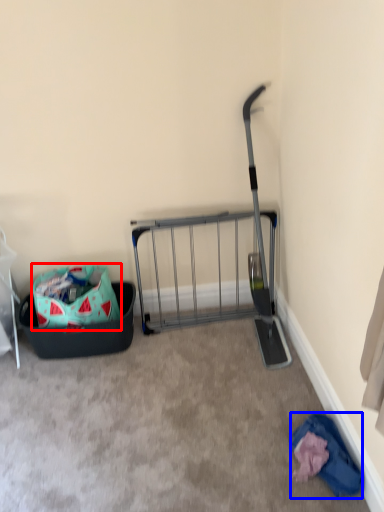
Question: Which object appears farthest to the camera in this image, bag (highlighted by a red box) or clothing (highlighted by a blue box)?

Choices:
 (A) bag
 (B) clothing

Answer: (A)